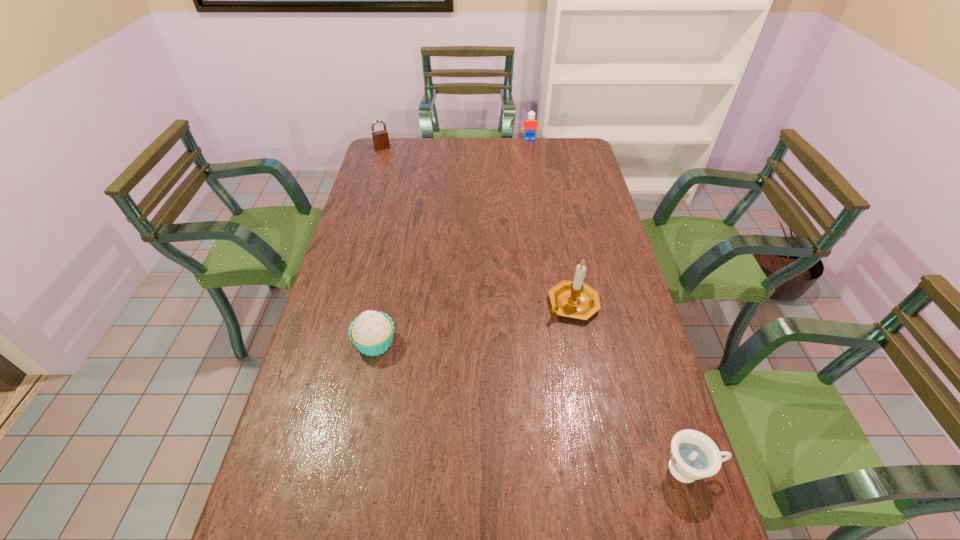
Identify the location of vacant space on the desktop that is between the second nearest object and the shortest object and is positioned with a handle on the candle holder. (525, 403).

You are a GUI agent. You are given a task and a screenshot of the screen. Output one action in this format:
    pyautogui.click(x=<x>, y=<y>)
    Task: Click on the free space on the desktop that is between the cupcake and the shortest object and is positioned on the front-facing side of the padlock
    The width and height of the screenshot is (960, 540).
    Given the screenshot: What is the action you would take?
    pyautogui.click(x=521, y=401)

I want to click on vacant space on the desktop that is between the second nearest object and the shortest object and is positioned on the face of the farthest object, so click(546, 411).